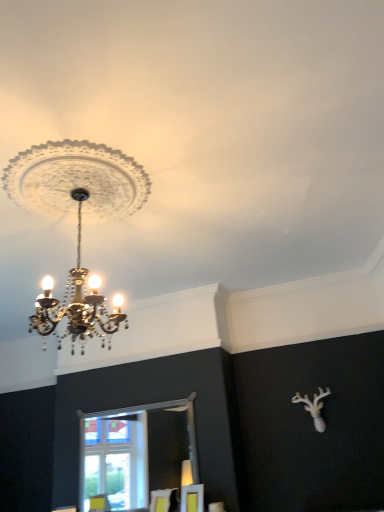
What do you see at coordinates (78, 222) in the screenshot? Image resolution: width=384 pixels, height=512 pixels. I see `gold crystal chandelier at upper left` at bounding box center [78, 222].

Measure the distance between gold crystal chandelier at upper left and camera.

The depth of gold crystal chandelier at upper left is 2.06 meters.

What is the approximate width of gold crystal chandelier at upper left?

31.48 inches.

What are the coordinates of `gold crystal chandelier at upper left` in the screenshot? It's located at (78, 222).

Find the location of a particular element. gold crystal chandelier at upper left is located at coordinates (78, 222).